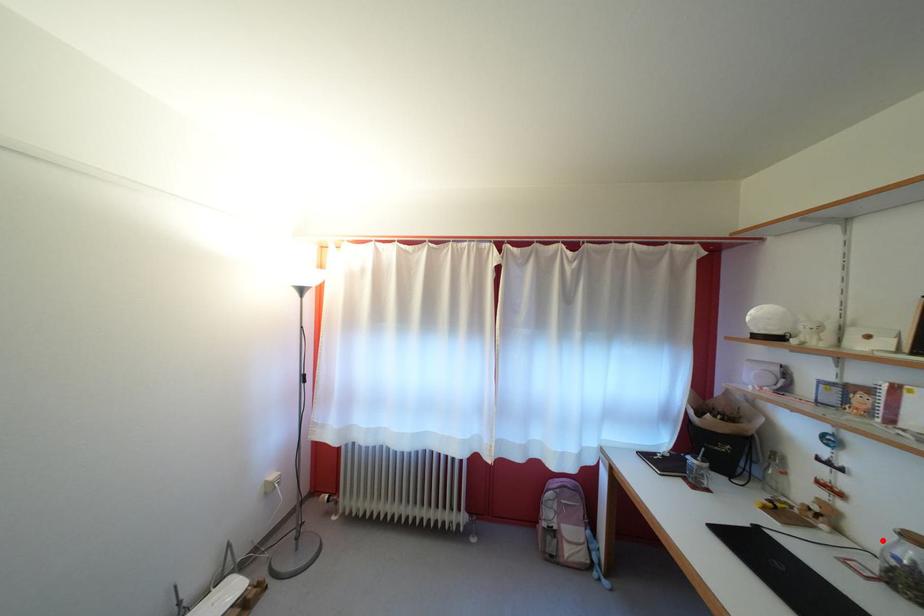
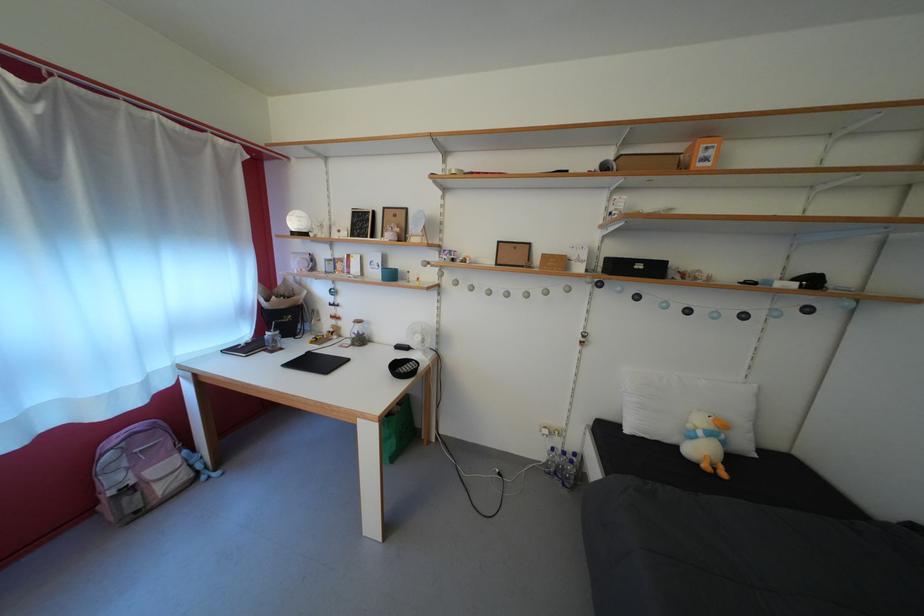
Question: I am providing you with two images of the same scene from different viewpoints. Image1 has a red point marked. In image2, the corresponding 3D location appears at what relative position? Reply with the corresponding letter.

Choices:
 (A) Closer
 (B) Farther

Answer: (B)